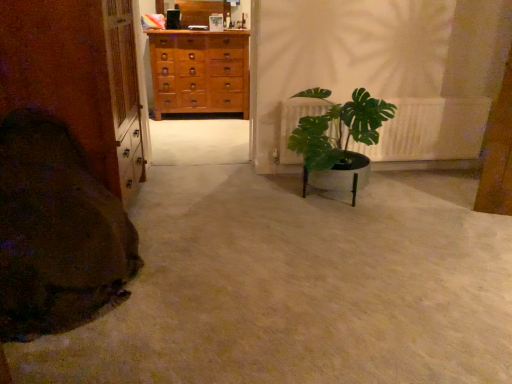
Question: Is brown soft blanket at lower left positioned in front of green leafy plant at center?

Choices:
 (A) no
 (B) yes

Answer: (B)

Question: Is brown soft blanket at lower left at the right side of green leafy plant at center?

Choices:
 (A) yes
 (B) no

Answer: (B)

Question: From a real-world perspective, is brown soft blanket at lower left positioned over green leafy plant at center based on gravity?

Choices:
 (A) yes
 (B) no

Answer: (B)

Question: From the image's perspective, is brown soft blanket at lower left beneath green leafy plant at center?

Choices:
 (A) no
 (B) yes

Answer: (B)

Question: Considering the relative sizes of brown soft blanket at lower left and green leafy plant at center in the image provided, is brown soft blanket at lower left smaller than green leafy plant at center?

Choices:
 (A) no
 (B) yes

Answer: (A)

Question: Could you tell me if brown soft blanket at lower left is turned towards green leafy plant at center?

Choices:
 (A) no
 (B) yes

Answer: (A)

Question: Is green leafy plant at center outside of brown soft blanket at lower left?

Choices:
 (A) no
 (B) yes

Answer: (B)

Question: From the image's perspective, is green leafy plant at center beneath brown soft blanket at lower left?

Choices:
 (A) yes
 (B) no

Answer: (B)

Question: From the image's perspective, is green leafy plant at center on brown soft blanket at lower left?

Choices:
 (A) yes
 (B) no

Answer: (A)

Question: Does green leafy plant at center have a greater height compared to brown soft blanket at lower left?

Choices:
 (A) yes
 (B) no

Answer: (B)

Question: From a real-world perspective, is green leafy plant at center on brown soft blanket at lower left?

Choices:
 (A) no
 (B) yes

Answer: (B)

Question: Can you confirm if green leafy plant at center is thinner than brown soft blanket at lower left?

Choices:
 (A) no
 (B) yes

Answer: (B)

Question: Does green leafy plant at center have a lesser width compared to light brown wooden chest of drawers at center?

Choices:
 (A) yes
 (B) no

Answer: (B)